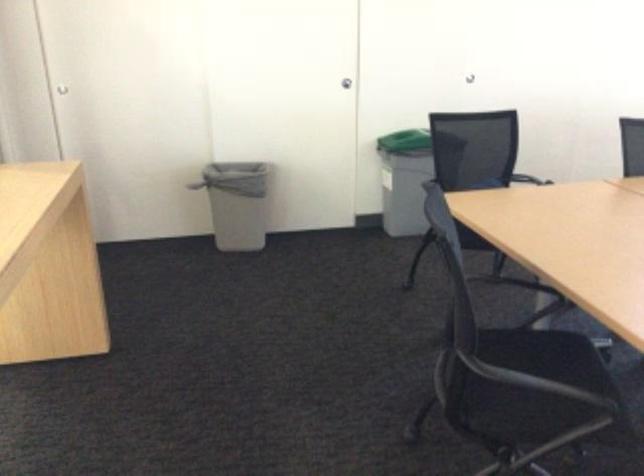
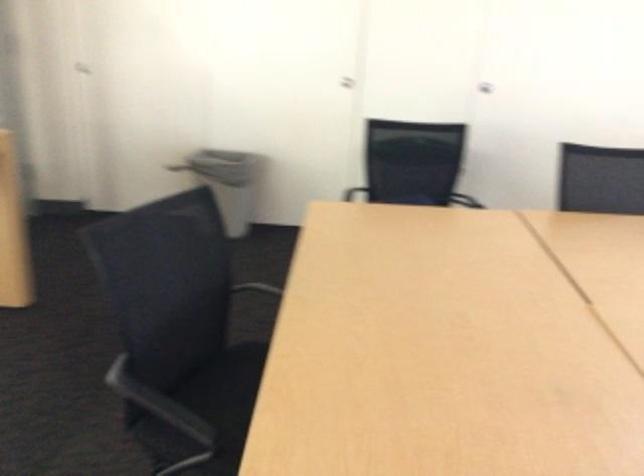
Question: What movement of the cameraman would produce the second image?

Choices:
 (A) Left
 (B) Right
 (C) Forward
 (D) Backward

Answer: (B)